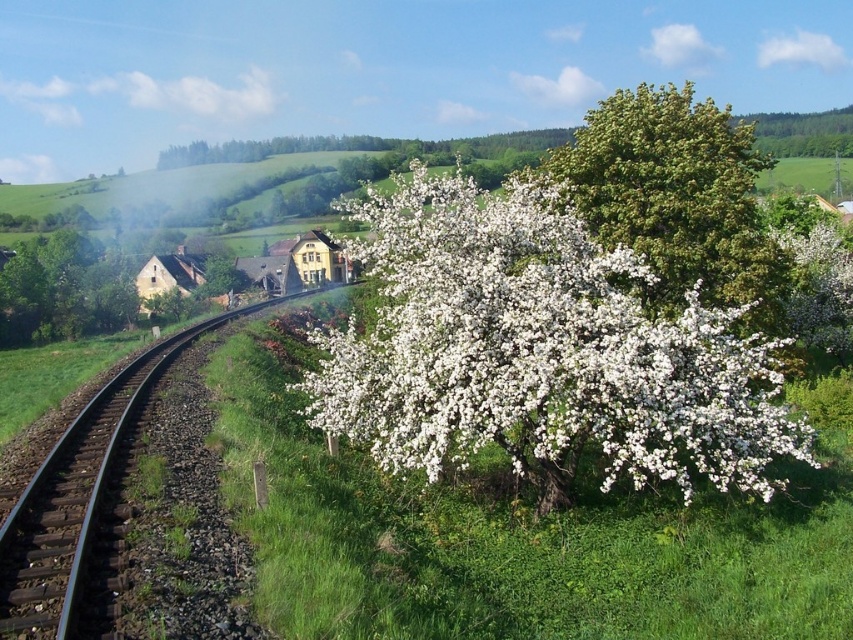
Question: Observing the image, what is the correct spatial positioning of white fluffy blossoms at center in reference to black metal train track at center?

Choices:
 (A) below
 (B) above

Answer: (B)

Question: Is green leafy tree at upper center to the right of black metal train track at center from the viewer's perspective?

Choices:
 (A) no
 (B) yes

Answer: (B)

Question: Can you confirm if green leafy tree at upper center is thinner than black metal train track at center?

Choices:
 (A) no
 (B) yes

Answer: (A)

Question: Which point appears closest to the camera in this image?

Choices:
 (A) (99, 413)
 (B) (718, 225)
 (C) (525, 298)

Answer: (C)

Question: Among these points, which one is nearest to the camera?

Choices:
 (A) (521, 252)
 (B) (755, 168)
 (C) (97, 388)

Answer: (A)

Question: Among these objects, which one is farthest from the camera?

Choices:
 (A) white fluffy blossoms at center
 (B) green leafy tree at upper center

Answer: (B)